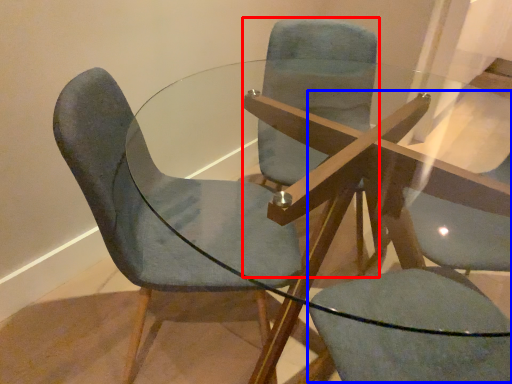
Question: Which object is further to the camera taking this photo, chair (highlighted by a red box) or swivel chair (highlighted by a blue box)?

Choices:
 (A) chair
 (B) swivel chair

Answer: (A)